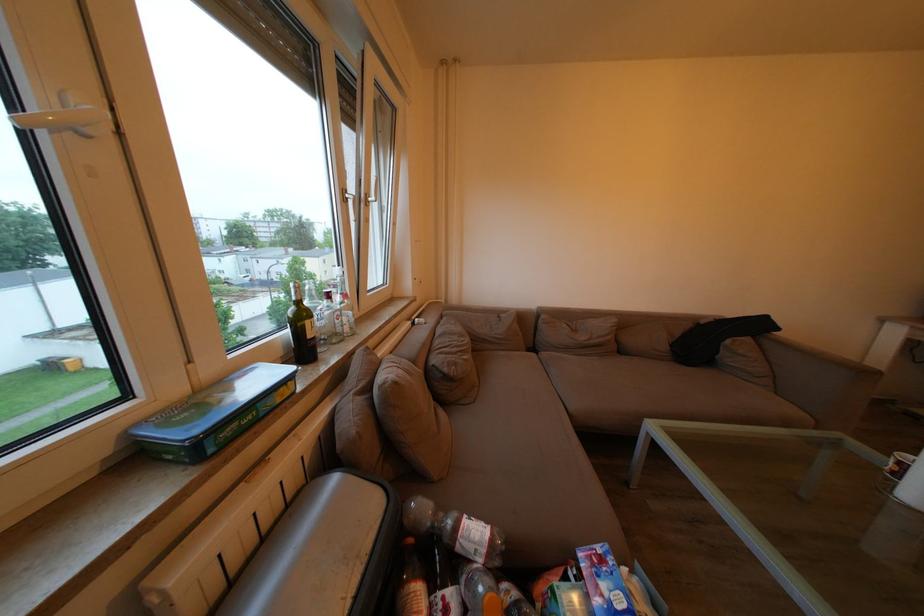
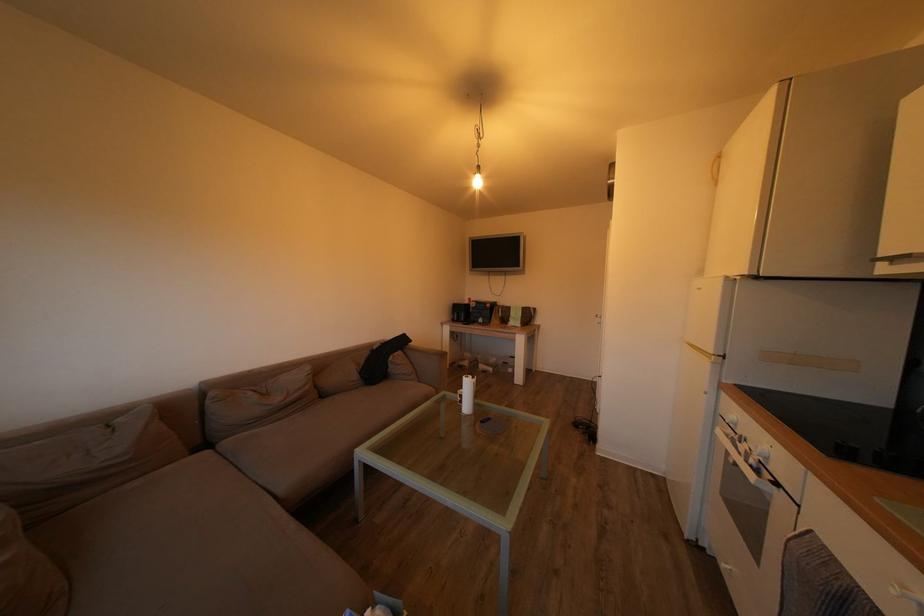
In the second image, find the point that corresponds to point (785, 334) in the first image.

(419, 347)